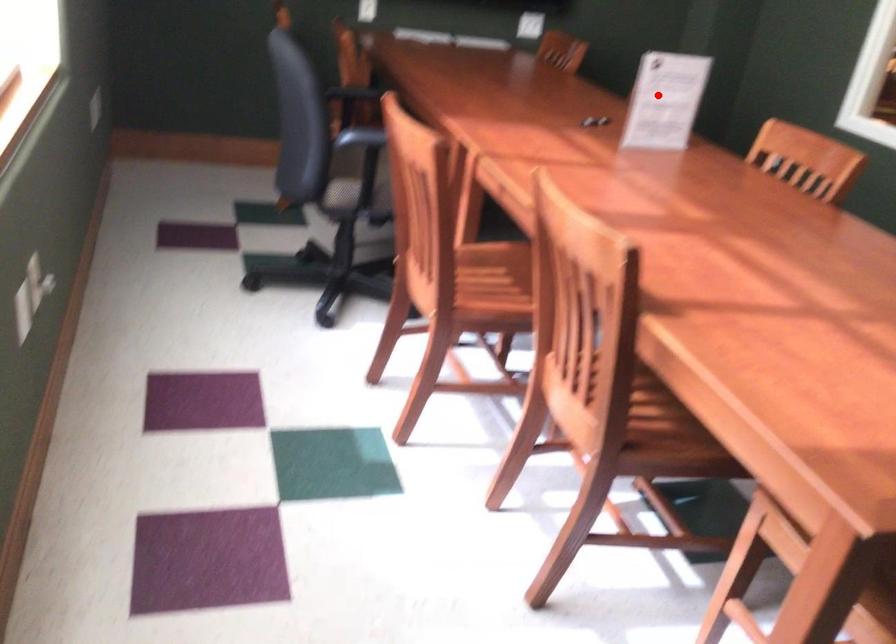
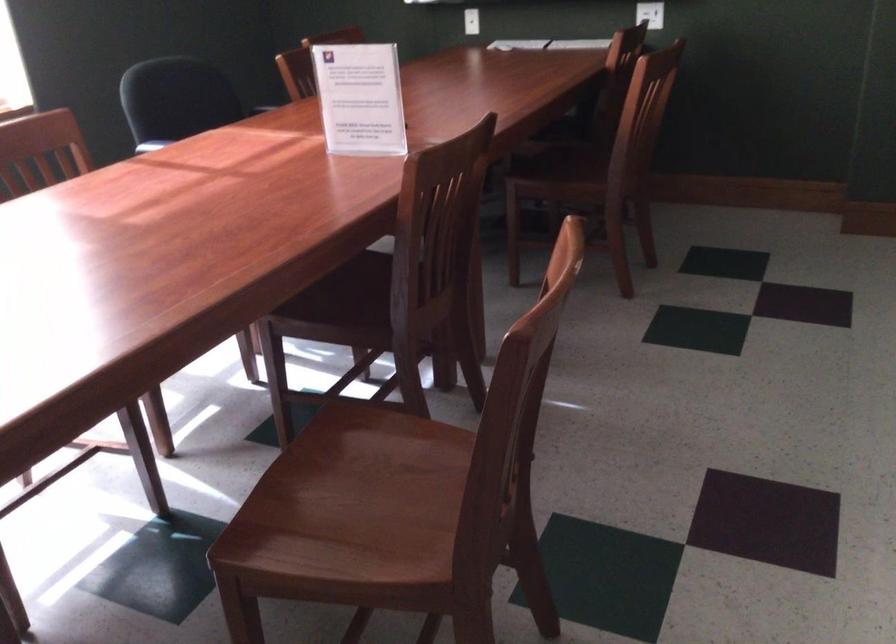
Question: I am providing you with two images of the same scene from different viewpoints. A red point is shown in image1. For the corresponding object point in image2, is it positioned nearer or farther from the camera?

Choices:
 (A) Nearer
 (B) Farther

Answer: (A)